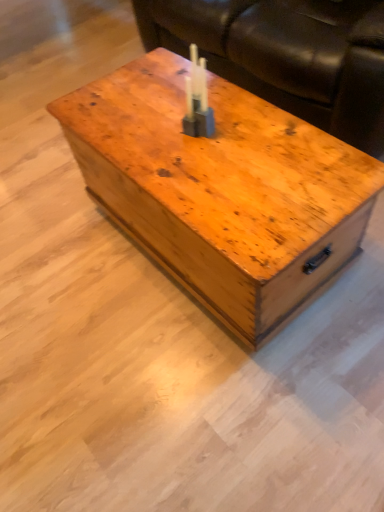
Question: Should I look upward or downward to see wooden chest at center?

Choices:
 (A) up
 (B) down

Answer: (A)

Question: Can you confirm if translucent plastic candle at center is wider than brown leather couch at upper center?

Choices:
 (A) yes
 (B) no

Answer: (B)

Question: From the image's perspective, is translucent plastic candle at center located above brown leather couch at upper center?

Choices:
 (A) yes
 (B) no

Answer: (B)

Question: Is translucent plastic candle at center directly adjacent to brown leather couch at upper center?

Choices:
 (A) yes
 (B) no

Answer: (B)

Question: From a real-world perspective, is translucent plastic candle at center on top of brown leather couch at upper center?

Choices:
 (A) no
 (B) yes

Answer: (B)

Question: Is translucent plastic candle at center taller than brown leather couch at upper center?

Choices:
 (A) no
 (B) yes

Answer: (A)

Question: Is translucent plastic candle at center outside brown leather couch at upper center?

Choices:
 (A) yes
 (B) no

Answer: (A)

Question: From the image's perspective, is brown leather couch at upper center on translucent plastic candle at center?

Choices:
 (A) no
 (B) yes

Answer: (B)

Question: Is brown leather couch at upper center facing towards translucent plastic candle at center?

Choices:
 (A) yes
 (B) no

Answer: (A)

Question: Considering the relative positions of brown leather couch at upper center and translucent plastic candle at center in the image provided, is brown leather couch at upper center behind translucent plastic candle at center?

Choices:
 (A) no
 (B) yes

Answer: (B)

Question: Is brown leather couch at upper center not inside translucent plastic candle at center?

Choices:
 (A) yes
 (B) no

Answer: (A)

Question: Does brown leather couch at upper center have a greater width compared to translucent plastic candle at center?

Choices:
 (A) yes
 (B) no

Answer: (A)

Question: Is brown leather couch at upper center taller than translucent plastic candle at center?

Choices:
 (A) yes
 (B) no

Answer: (A)

Question: Does wooden chest at center have a larger size compared to brown leather couch at upper center?

Choices:
 (A) no
 (B) yes

Answer: (A)